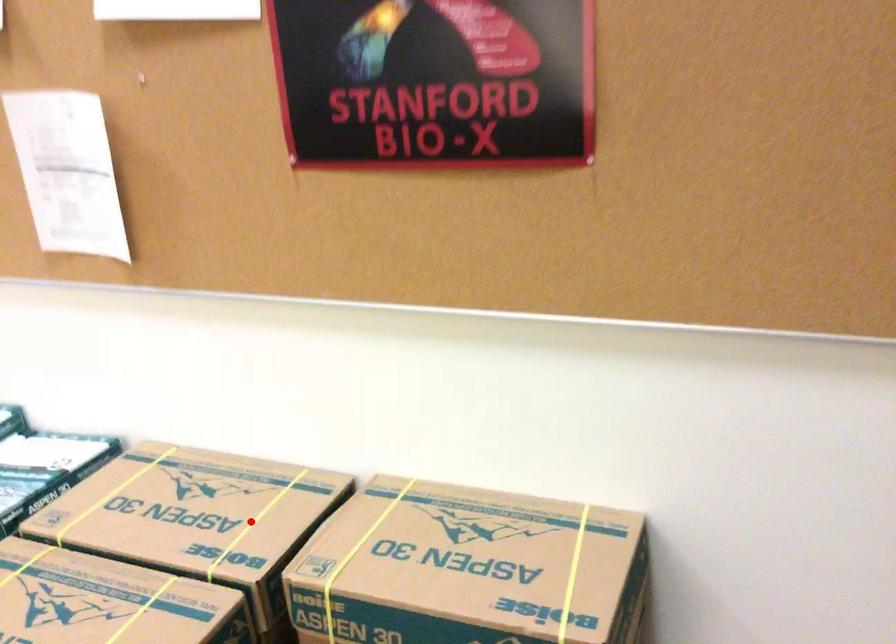
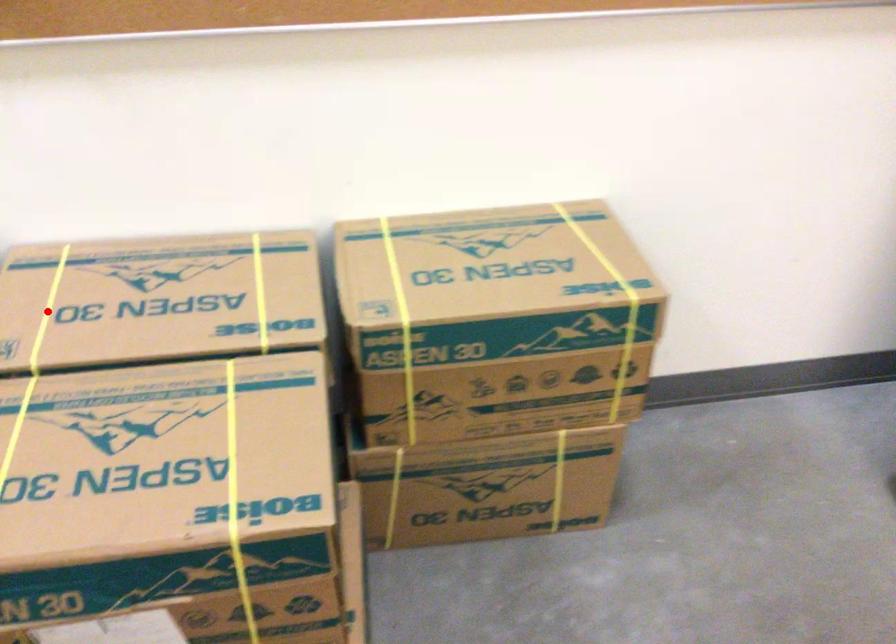
I am providing you with two images of the same scene from different viewpoints. A red point is marked on the first image and another point is marked on the second image. Is the red point in image1 aligned with the point shown in image2?

No